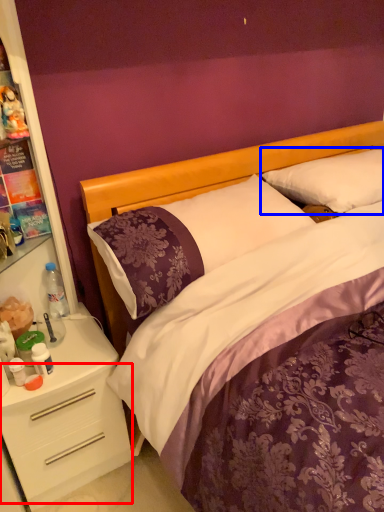
Question: Which object is closer to the camera taking this photo, drawer (highlighted by a red box) or pillow (highlighted by a blue box)?

Choices:
 (A) drawer
 (B) pillow

Answer: (A)